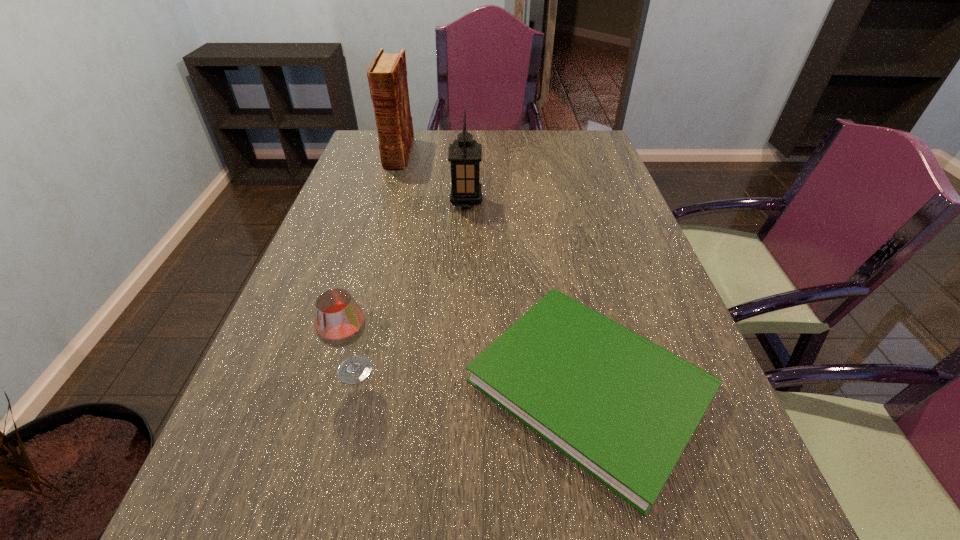
Find the location of a particular element. This screenshot has height=540, width=960. wineglass positioned at the left edge is located at coordinates (339, 322).

What are the coordinates of `object that is at the right edge` in the screenshot? It's located at (621, 407).

You are a GUI agent. You are given a task and a screenshot of the screen. Output one action in this format:
    pyautogui.click(x=<x>, y=<y>)
    Task: Click on the object that is positioned at the far left corner
    The height and width of the screenshot is (540, 960).
    Given the screenshot: What is the action you would take?
    pyautogui.click(x=387, y=75)

This screenshot has height=540, width=960. In order to click on vacant space at the far edge in this screenshot , I will do [x=445, y=136].

This screenshot has height=540, width=960. I want to click on vacant space at the left edge of the desktop, so click(x=260, y=527).

Find the location of `free region at the right edge`. free region at the right edge is located at coordinates point(614,268).

I want to click on vacant space at the far right corner of the desktop, so click(x=583, y=146).

Locate an element on the screen. The image size is (960, 540). empty space that is in between the lantern and the farthest object is located at coordinates (432, 178).

Where is `empty space that is in between the hardback book and the second farthest object`? This screenshot has height=540, width=960. empty space that is in between the hardback book and the second farthest object is located at coordinates (432, 178).

The width and height of the screenshot is (960, 540). Find the location of `vacant space in between the farthest object and the third nearest object`. vacant space in between the farthest object and the third nearest object is located at coordinates (432, 178).